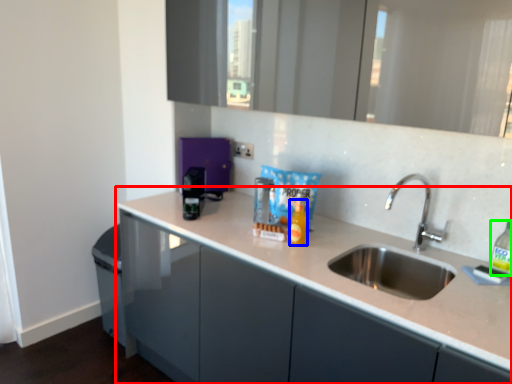
Question: Estimate the real-world distances between objects in this image. Which object is closer to countertop (highlighted by a red box), bottle (highlighted by a blue box) or bottle (highlighted by a green box)?

Choices:
 (A) bottle
 (B) bottle

Answer: (A)